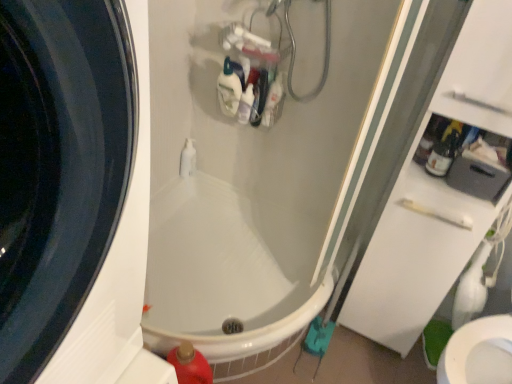
Describe the element at coordinates (246, 105) in the screenshot. Image resolution: width=512 pixels, height=384 pixels. I see `white glossy bottle at upper center, the 2th cleaning product in the bottom-to-top sequence` at that location.

The image size is (512, 384). I want to click on translucent plastic bottle at upper right, so (443, 154).

Image resolution: width=512 pixels, height=384 pixels. I want to click on translucent plastic bottle at upper center, the 3th cleaning product positioned from the bottom, so click(x=230, y=87).

This screenshot has height=384, width=512. Find the location of `white glossy pump bottle at center`. white glossy pump bottle at center is located at coordinates (188, 159).

At what (x,y) coordinates should I click in order to perform the action: click on red plastic bottle at lower left, the 1th cleaning product from the bottom. Please return your answer as a coordinate pair (x, y). Image resolution: width=512 pixels, height=384 pixels. Looking at the image, I should click on (190, 365).

In order to face red plastic bottle at lower left, the 1th cleaning product from the bottom, should I rotate leftwards or rightwards?

Rotate left and turn 8.326 degrees.

The height and width of the screenshot is (384, 512). I want to click on white glossy bottle at upper center, the 2th cleaning product in the bottom-to-top sequence, so click(246, 105).

Which of these two, white glossy bathtub at center or translucent plastic bottle at upper center, which appears as the 1th cleaning product when viewed from the top, is thinner?

translucent plastic bottle at upper center, which appears as the 1th cleaning product when viewed from the top, is thinner.

From a real-world perspective, does white glossy bathtub at center stand above translucent plastic bottle at upper center, which is the 3th cleaning product in front-to-back order?

No.

Between white glossy bathtub at center and translucent plastic bottle at upper center, the first cleaning product in the back-to-front sequence, which one is positioned in front?

white glossy bathtub at center is in front.

From the image's perspective, is white glossy bathtub at center above translucent plastic bottle at upper center, the 3th cleaning product positioned from the bottom?

No, from the image's perspective, white glossy bathtub at center is not on top of translucent plastic bottle at upper center, the 3th cleaning product positioned from the bottom.

Is translucent plastic bottle at upper right oriented away from red plastic bottle at lower left, acting as the first cleaning product starting from the front?

No.

From the image's perspective, is translucent plastic bottle at upper right positioned above or below red plastic bottle at lower left, acting as the first cleaning product starting from the front?

translucent plastic bottle at upper right is above red plastic bottle at lower left, acting as the first cleaning product starting from the front.

Consider the image. Can you confirm if translucent plastic bottle at upper right is wider than red plastic bottle at lower left, the 1th cleaning product from the bottom?

No, translucent plastic bottle at upper right is not wider than red plastic bottle at lower left, the 1th cleaning product from the bottom.

Measure the distance between translucent plastic bottle at upper right and red plastic bottle at lower left, the 3th cleaning product in the back-to-front sequence.

translucent plastic bottle at upper right is 38.79 inches away from red plastic bottle at lower left, the 3th cleaning product in the back-to-front sequence.

How many degrees apart are the facing directions of white glossy bottle at upper center, the second cleaning product positioned from the front, and white glossy bathtub at center?

There is a 0.00231-degree angle between the facing directions of white glossy bottle at upper center, the second cleaning product positioned from the front, and white glossy bathtub at center.

Does white glossy bottle at upper center, positioned as the second cleaning product in back-to-front order, turn towards white glossy bathtub at center?

No.

Visually, is white glossy bottle at upper center, the second cleaning product positioned from the front, positioned to the left or to the right of white glossy bathtub at center?

white glossy bottle at upper center, the second cleaning product positioned from the front, is positioned on white glossy bathtub at center's right side.

From the image's perspective, is white glossy bottle at upper center, the second cleaning product positioned from the front, above or below white glossy bathtub at center?

Based on their image positions, white glossy bottle at upper center, the second cleaning product positioned from the front, is located above white glossy bathtub at center.

Is white glossy bathtub at center at the back of translucent plastic bottle at upper center, the 3th cleaning product positioned from the bottom?

No.

Is translucent plastic bottle at upper center, which is the 3th cleaning product in front-to-back order, shorter than white glossy bathtub at center?

Yes.

Is translucent plastic bottle at upper center, the first cleaning product in the back-to-front sequence, with white glossy bathtub at center?

No, translucent plastic bottle at upper center, the first cleaning product in the back-to-front sequence, is not making contact with white glossy bathtub at center.

Does translucent plastic bottle at upper center, the 3th cleaning product positioned from the bottom, turn towards white glossy bottle at upper center, positioned as the second cleaning product in back-to-front order?

No, translucent plastic bottle at upper center, the 3th cleaning product positioned from the bottom, is not aimed at white glossy bottle at upper center, positioned as the second cleaning product in back-to-front order.

Is point (238, 68) behind point (238, 107)?

No, (238, 68) is in front of (238, 107).

At what (x,y) coordinates should I click in order to perform the action: click on cleaning product above the white glossy bottle at upper center, the 2th cleaning product in the bottom-to-top sequence (from the image's perspective). Please return your answer as a coordinate pair (x, y). Looking at the image, I should click on (230, 87).

Between translucent plastic bottle at upper right and white glossy bathtub at center, which one has more height?

Standing taller between the two is white glossy bathtub at center.

Would you say translucent plastic bottle at upper right contains white glossy bathtub at center?

No, white glossy bathtub at center is not a part of translucent plastic bottle at upper right.

Is translucent plastic bottle at upper right oriented towards white glossy bathtub at center?

No, translucent plastic bottle at upper right is not aimed at white glossy bathtub at center.

Is the surface of translucent plastic bottle at upper right in direct contact with white glossy bathtub at center?

translucent plastic bottle at upper right and white glossy bathtub at center are clearly separated.

Based on the photo, who is smaller, white glossy bottle at upper center, the second cleaning product positioned from the front, or translucent plastic bottle at upper center, which is the 3th cleaning product in front-to-back order?

translucent plastic bottle at upper center, which is the 3th cleaning product in front-to-back order, is smaller.

From the image's perspective, who appears lower, white glossy bottle at upper center, positioned as the second cleaning product in back-to-front order, or translucent plastic bottle at upper center, the 3th cleaning product positioned from the bottom?

white glossy bottle at upper center, positioned as the second cleaning product in back-to-front order, is shown below in the image.

Is translucent plastic bottle at upper center, which is the 3th cleaning product in front-to-back order, located within white glossy bottle at upper center, arranged as the 2th cleaning product when viewed from the top?

Definitely not — translucent plastic bottle at upper center, which is the 3th cleaning product in front-to-back order, is not inside white glossy bottle at upper center, arranged as the 2th cleaning product when viewed from the top.

Which of these two, white glossy bottle at upper center, arranged as the 2th cleaning product when viewed from the top, or translucent plastic bottle at upper center, the 3th cleaning product positioned from the bottom, is wider?

white glossy bottle at upper center, arranged as the 2th cleaning product when viewed from the top.

This screenshot has width=512, height=384. In order to click on bath in front of the translucent plastic bottle at upper center, the 3th cleaning product positioned from the bottom in this screenshot , I will do `click(218, 275)`.

I want to click on bottle that is on the right side of red plastic bottle at lower left, which ranks as the third cleaning product in top-to-bottom order, so click(x=443, y=154).

Based on their spatial positions, is white glossy bottle at upper center, the 2th cleaning product in the bottom-to-top sequence, or white glossy bathtub at center closer to translucent plastic bottle at upper right?

Based on the image, white glossy bottle at upper center, the 2th cleaning product in the bottom-to-top sequence, appears to be nearer to translucent plastic bottle at upper right.

Based on their spatial positions, is white glossy bottle at upper center, the 2th cleaning product in the bottom-to-top sequence, or translucent plastic bottle at upper right closer to red plastic bottle at lower left, the 3th cleaning product in the back-to-front sequence?

white glossy bottle at upper center, the 2th cleaning product in the bottom-to-top sequence.

Considering their positions, is translucent plastic bottle at upper right positioned further to translucent plastic bottle at upper center, which appears as the 1th cleaning product when viewed from the top, than white glossy bottle at upper center, arranged as the 2th cleaning product when viewed from the top?

The object further to translucent plastic bottle at upper center, which appears as the 1th cleaning product when viewed from the top, is translucent plastic bottle at upper right.

Estimate the real-world distances between objects in this image. Which object is further from white glossy bathtub at center, white glossy bottle at upper center, positioned as the second cleaning product in back-to-front order, or white glossy pump bottle at center?

white glossy bottle at upper center, positioned as the second cleaning product in back-to-front order, is positioned further to the anchor white glossy bathtub at center.

Based on their spatial positions, is red plastic bottle at lower left, acting as the first cleaning product starting from the front, or white glossy bottle at upper center, the 2th cleaning product in the bottom-to-top sequence, closer to white glossy bathtub at center?

red plastic bottle at lower left, acting as the first cleaning product starting from the front, is closer to white glossy bathtub at center.

From the image, which object appears to be nearer to white glossy bathtub at center, white glossy pump bottle at center or white glossy bottle at upper center, the second cleaning product positioned from the front?

Among the two, white glossy pump bottle at center is located nearer to white glossy bathtub at center.

From the image, which object appears to be farther from white glossy pump bottle at center, white glossy bottle at upper center, positioned as the second cleaning product in back-to-front order, or translucent plastic bottle at upper center, which appears as the 1th cleaning product when viewed from the top?

Among the two, white glossy bottle at upper center, positioned as the second cleaning product in back-to-front order, is located further to white glossy pump bottle at center.

From the image, which object appears to be farther from translucent plastic bottle at upper center, the 3th cleaning product positioned from the bottom, translucent plastic bottle at upper right or white glossy bathtub at center?

translucent plastic bottle at upper right is further to translucent plastic bottle at upper center, the 3th cleaning product positioned from the bottom.

Where is `bottle between white glossy bottle at upper center, the 2th cleaning product in the bottom-to-top sequence, and red plastic bottle at lower left, which ranks as the third cleaning product in top-to-bottom order, from top to bottom`? This screenshot has width=512, height=384. bottle between white glossy bottle at upper center, the 2th cleaning product in the bottom-to-top sequence, and red plastic bottle at lower left, which ranks as the third cleaning product in top-to-bottom order, from top to bottom is located at coordinates (443, 154).

Where is `bath between red plastic bottle at lower left, acting as the first cleaning product starting from the front, and translucent plastic bottle at upper right`? The width and height of the screenshot is (512, 384). bath between red plastic bottle at lower left, acting as the first cleaning product starting from the front, and translucent plastic bottle at upper right is located at coordinates (218, 275).

The width and height of the screenshot is (512, 384). In order to click on toiletry between translucent plastic bottle at upper center, which appears as the 1th cleaning product when viewed from the top, and white glossy bathtub at center in the up-down direction in this screenshot , I will do `click(188, 159)`.

At what (x,y) coordinates should I click in order to perform the action: click on cleaning product situated between translucent plastic bottle at upper center, the first cleaning product in the back-to-front sequence, and translucent plastic bottle at upper right from left to right. Please return your answer as a coordinate pair (x, y). This screenshot has height=384, width=512. Looking at the image, I should click on (246, 105).